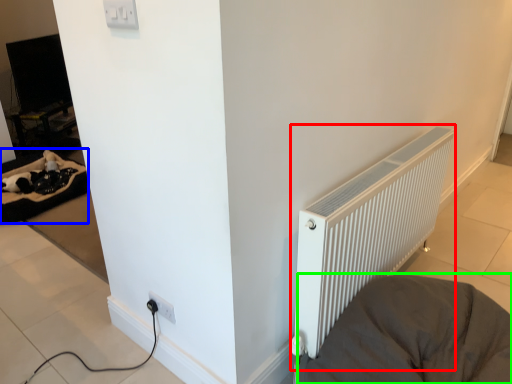
Question: Considering the real-world distances, which object is closest to radiator (highlighted by a red box)? bedding (highlighted by a blue box) or furniture (highlighted by a green box).

Choices:
 (A) bedding
 (B) furniture

Answer: (B)